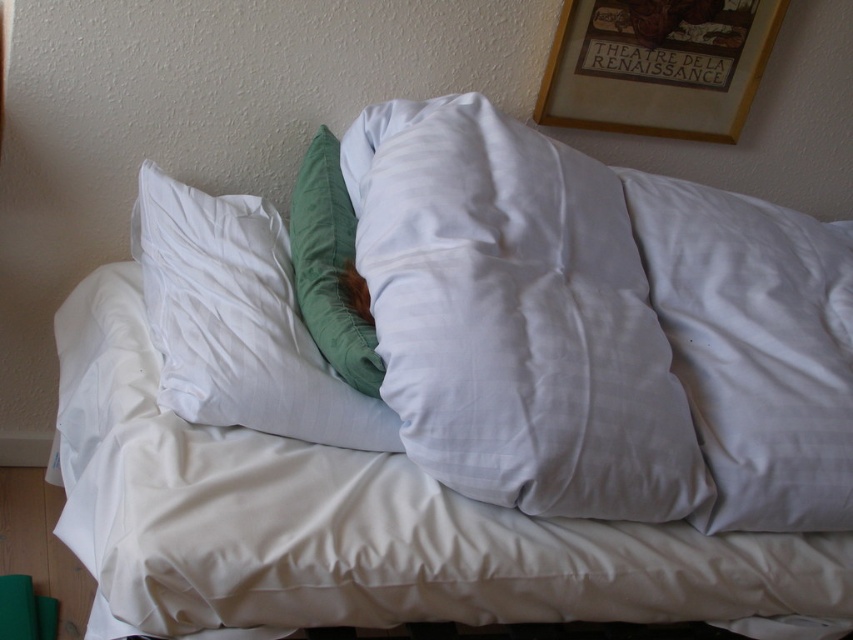
Question: Which point is closer to the camera?

Choices:
 (A) (834, 483)
 (B) (361, 442)

Answer: (A)

Question: Can you confirm if white smooth pillow at left is positioned to the left of velvety green pillow at center?

Choices:
 (A) no
 (B) yes

Answer: (B)

Question: Which of the following is the farthest from the observer?

Choices:
 (A) velvety green pillow at center
 (B) white smooth pillow at center
 (C) wooden picture frame at upper center
 (D) white smooth pillow at left

Answer: (C)

Question: From the image, what is the correct spatial relationship of white smooth pillow at right in relation to white smooth pillow at left?

Choices:
 (A) right
 (B) left

Answer: (A)

Question: Observing the image, what is the correct spatial positioning of white smooth pillow at right in reference to wooden picture frame at upper center?

Choices:
 (A) above
 (B) below

Answer: (B)

Question: Among these objects, which one is farthest from the camera?

Choices:
 (A) wooden picture frame at upper center
 (B) velvety green pillow at center

Answer: (A)